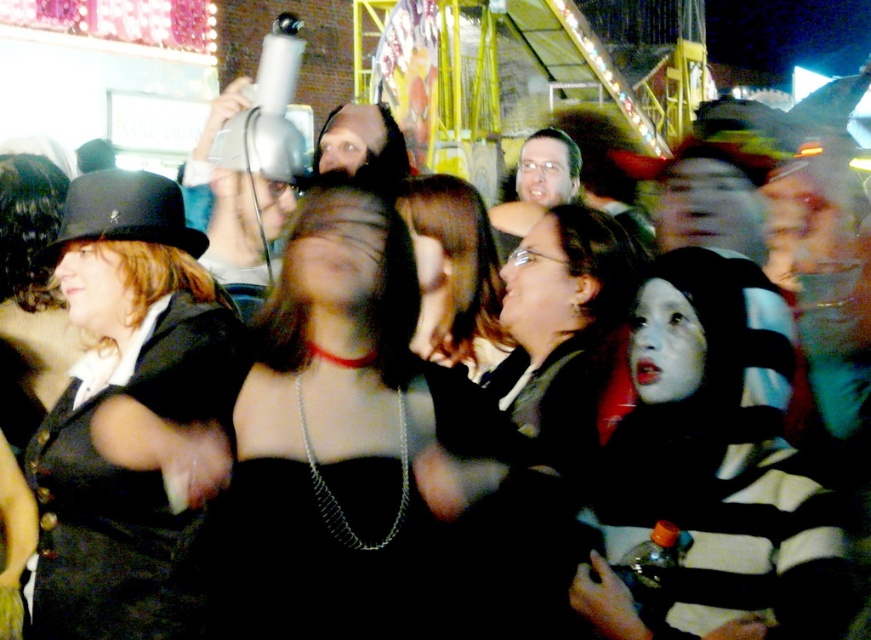
You are standing at the point with coordinates point (346,448). Which object are you currently standing on?

You are standing on the black matte dress at center.

You are standing at the point labeled point (485,452) and want to reach the Ferris wheel in the background. The path is straight, but there is a fence blocking the way. The fence is located exactly halfway between you and the Ferris wheel. Can you walk around the fence to reach the Ferris wheel? Please explain your reasoning.

Yes, you can walk around the fence to reach the Ferris wheel. Since the fence is halfway between you and the Ferris wheel, which are 41.04 meters apart, the distance to the fence is 20.52 meters. You can go around the fence by taking a path that detours around it, as fences typically have gates or pathways around them, allowing you to continue toward the Ferris wheel.